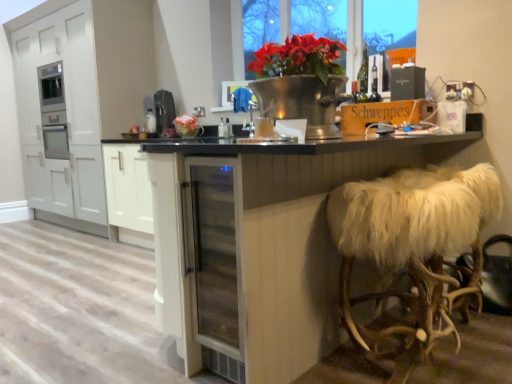
What is the approximate height of matte black box at upper right, which is the first appliance from right to left?

The height of matte black box at upper right, which is the first appliance from right to left, is 21.94 centimeters.

Describe the element at coordinates (389, 24) in the screenshot. I see `red matte flower pot at upper center` at that location.

The width and height of the screenshot is (512, 384). In order to click on white matte cabinet at left in this screenshot , I will do `click(100, 76)`.

Describe the element at coordinates (164, 109) in the screenshot. I see `black plastic coffee machine at center, placed as the 1th appliance when sorted from left to right` at that location.

Describe the element at coordinates (262, 243) in the screenshot. I see `transparent glass table at center` at that location.

You are a GUI agent. You are given a task and a screenshot of the screen. Output one action in this format:
    pyautogui.click(x=<x>, y=<y>)
    Task: Click on the white fur-covered stool at right
    The width and height of the screenshot is (512, 384).
    Given the screenshot: What is the action you would take?
    pyautogui.click(x=413, y=248)

How distant is white matte cabinet at left from red matte flower pot at upper center?

5.25 feet.

Are white matte cabinet at left and red matte flower pot at upper center far apart?

white matte cabinet at left is far away from red matte flower pot at upper center.

Which object is closer to the camera taking this photo, white matte cabinet at left or red matte flower pot at upper center?

red matte flower pot at upper center.

From the image's perspective, is white matte cabinet at left on top of red matte flower pot at upper center?

No, from the image's perspective, white matte cabinet at left is not over red matte flower pot at upper center.

In the scene shown: Are white fur-covered stool at right and red matte flower pot at upper center making contact?

white fur-covered stool at right is not next to red matte flower pot at upper center, and they're not touching.

Which object is positioned more to the right, white fur-covered stool at right or red matte flower pot at upper center?

Positioned to the right is white fur-covered stool at right.

Which point is more forward, (443, 320) or (327, 34)?

The point (443, 320) is in front.

Is white fur-covered stool at right situated inside red matte flower pot at upper center or outside?

white fur-covered stool at right is outside red matte flower pot at upper center.

Is red matte flower pot at upper center wider or thinner than black plastic coffee machine at center, which is the 2th appliance in right-to-left order?

Considering their sizes, red matte flower pot at upper center looks slimmer than black plastic coffee machine at center, which is the 2th appliance in right-to-left order.

Choose the correct answer: Is red matte flower pot at upper center inside black plastic coffee machine at center, which is counted as the first appliance, starting from the back, or outside it?

red matte flower pot at upper center is not enclosed by black plastic coffee machine at center, which is counted as the first appliance, starting from the back.

Can you see red matte flower pot at upper center touching black plastic coffee machine at center, placed as the 1th appliance when sorted from left to right?

No.

Does red matte flower pot at upper center appear on the left side of black plastic coffee machine at center, which is counted as the first appliance, starting from the back?

No, red matte flower pot at upper center is not to the left of black plastic coffee machine at center, which is counted as the first appliance, starting from the back.

Image resolution: width=512 pixels, height=384 pixels. What are the coordinates of `appliance in front of the white matte cabinet at left` in the screenshot? It's located at (407, 83).

Which of these two, matte black box at upper right, which is counted as the first appliance, starting from the front, or white matte cabinet at left, is thinner?

With smaller width is matte black box at upper right, which is counted as the first appliance, starting from the front.

From a real-world perspective, who is located higher, matte black box at upper right, which is counted as the first appliance, starting from the front, or white matte cabinet at left?

matte black box at upper right, which is counted as the first appliance, starting from the front, from a real-world perspective.

Can you tell me how much red matte flower pot at upper center and white matte cabinet at left differ in facing direction?

0.000725 degrees separate the facing orientations of red matte flower pot at upper center and white matte cabinet at left.

Is red matte flower pot at upper center at the right side of white matte cabinet at left?

Yes.

Between red matte flower pot at upper center and white matte cabinet at left, which one has smaller size?

With smaller size is red matte flower pot at upper center.

Is white matte cabinet at left oriented away from white fur-covered stool at right?

No, white matte cabinet at left is not facing the opposite direction of white fur-covered stool at right.

Between white matte cabinet at left and white fur-covered stool at right, which one appears on the right side from the viewer's perspective?

white fur-covered stool at right.

Looking at the image, does white matte cabinet at left seem bigger or smaller compared to white fur-covered stool at right?

Clearly, white matte cabinet at left is larger in size than white fur-covered stool at right.

Looking at this image, considering the sizes of objects white matte cabinet at left and white fur-covered stool at right in the image provided, who is wider, white matte cabinet at left or white fur-covered stool at right?

white matte cabinet at left.

Which is correct: black plastic coffee machine at center, placed as the 1th appliance when sorted from left to right, is inside transparent glass table at center, or outside of it?

black plastic coffee machine at center, placed as the 1th appliance when sorted from left to right, is not enclosed by transparent glass table at center.

Measure the distance between black plastic coffee machine at center, the second appliance positioned from the front, and transparent glass table at center.

They are 2.32 meters apart.

Who is bigger, black plastic coffee machine at center, which is counted as the first appliance, starting from the back, or transparent glass table at center?

transparent glass table at center.

Is black plastic coffee machine at center, placed as the 1th appliance when sorted from left to right, placed right next to transparent glass table at center?

black plastic coffee machine at center, placed as the 1th appliance when sorted from left to right, and transparent glass table at center are clearly separated.

This screenshot has height=384, width=512. I want to click on cabinetry on the left of red matte flower pot at upper center, so click(x=100, y=76).

Identify the location of window screen above the white fur-covered stool at right (from a real-world perspective). (389, 24).

Looking at the image, which one is located closer to white fur-covered stool at right, white matte cabinet at left or matte black box at upper right, which is counted as the first appliance, starting from the front?

matte black box at upper right, which is counted as the first appliance, starting from the front, lies closer to white fur-covered stool at right than the other object.

From the image, which object appears to be nearer to matte black box at upper right, the second appliance viewed from the left, transparent glass table at center or black plastic coffee machine at center, placed as the 1th appliance when sorted from left to right?

Among the two, transparent glass table at center is located nearer to matte black box at upper right, the second appliance viewed from the left.

Considering their positions, is matte black box at upper right, the second appliance in the back-to-front sequence, positioned further to transparent glass table at center than black plastic coffee machine at center, which is the 2th appliance in right-to-left order?

black plastic coffee machine at center, which is the 2th appliance in right-to-left order, is positioned further to the anchor transparent glass table at center.

Which object lies nearer to the anchor point matte black box at upper right, the second appliance viewed from the left, white matte cabinet at left or black plastic coffee machine at center, the second appliance positioned from the front?

Based on the image, black plastic coffee machine at center, the second appliance positioned from the front, appears to be nearer to matte black box at upper right, the second appliance viewed from the left.

Considering their positions, is white fur-covered stool at right positioned further to red matte flower pot at upper center than black plastic coffee machine at center, which is counted as the first appliance, starting from the back?

The object further to red matte flower pot at upper center is white fur-covered stool at right.

When comparing their distances from white matte cabinet at left, does matte black box at upper right, the second appliance in the back-to-front sequence, or white fur-covered stool at right seem further?

Based on the image, white fur-covered stool at right appears to be further to white matte cabinet at left.

Based on their spatial positions, is black plastic coffee machine at center, the second appliance positioned from the front, or transparent glass table at center further from red matte flower pot at upper center?

transparent glass table at center is further to red matte flower pot at upper center.

Considering their positions, is white matte cabinet at left positioned closer to transparent glass table at center than black plastic coffee machine at center, placed as the 1th appliance when sorted from left to right?

Among the two, black plastic coffee machine at center, placed as the 1th appliance when sorted from left to right, is located nearer to transparent glass table at center.

You are a GUI agent. You are given a task and a screenshot of the screen. Output one action in this format:
    pyautogui.click(x=<x>, y=<y>)
    Task: Click on the window screen between white matte cabinet at left and matte black box at upper right, the second appliance in the back-to-front sequence
    The height and width of the screenshot is (384, 512).
    Given the screenshot: What is the action you would take?
    pyautogui.click(x=389, y=24)

I want to click on table situated between white matte cabinet at left and matte black box at upper right, which is the first appliance from right to left, from left to right, so click(x=262, y=243).

You are a GUI agent. You are given a task and a screenshot of the screen. Output one action in this format:
    pyautogui.click(x=<x>, y=<y>)
    Task: Click on the table between red matte flower pot at upper center and white fur-covered stool at right in the vertical direction
    This screenshot has height=384, width=512.
    Given the screenshot: What is the action you would take?
    pyautogui.click(x=262, y=243)

The image size is (512, 384). I want to click on appliance between white fur-covered stool at right and black plastic coffee machine at center, which is counted as the first appliance, starting from the back, along the z-axis, so click(407, 83).